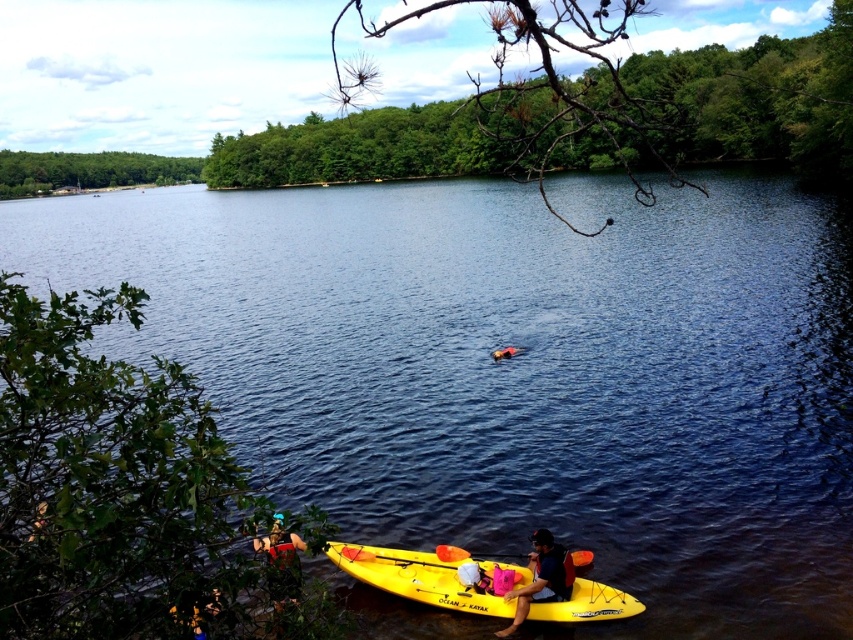
This screenshot has width=853, height=640. Identify the location of yellow plastic kayak at lower center. (541, 579).

Does point (564, 573) come closer to viewer compared to point (511, 554)?

That is True.

Is point (567, 566) positioned behind point (589, 563)?

No, (567, 566) is closer to viewer.

At what (x,y) coordinates should I click in order to perform the action: click on yellow plastic kayak at lower center. Please return your answer as a coordinate pair (x, y). The width and height of the screenshot is (853, 640). Looking at the image, I should click on (541, 579).

Is yellow matte kayak at lower center in front of yellow plastic paddle at lower center?

Yes.

You are a GUI agent. You are given a task and a screenshot of the screen. Output one action in this format:
    pyautogui.click(x=<x>, y=<y>)
    Task: Click on the yellow matte kayak at lower center
    The image size is (853, 640).
    Given the screenshot: What is the action you would take?
    pyautogui.click(x=416, y=577)

This screenshot has width=853, height=640. What do you see at coordinates (416, 577) in the screenshot? I see `yellow matte kayak at lower center` at bounding box center [416, 577].

Identify the location of yellow matte kayak at lower center. The image size is (853, 640). (416, 577).

Is blue water at center positioned in front of yellow plastic paddle at lower center?

Yes, blue water at center is in front of yellow plastic paddle at lower center.

Which is behind, point (341, 488) or point (579, 556)?

Positioned behind is point (341, 488).

You are a GUI agent. You are given a task and a screenshot of the screen. Output one action in this format:
    pyautogui.click(x=<x>, y=<y>)
    Task: Click on the blue water at center
    The height and width of the screenshot is (640, 853).
    Given the screenshot: What is the action you would take?
    pyautogui.click(x=517, y=369)